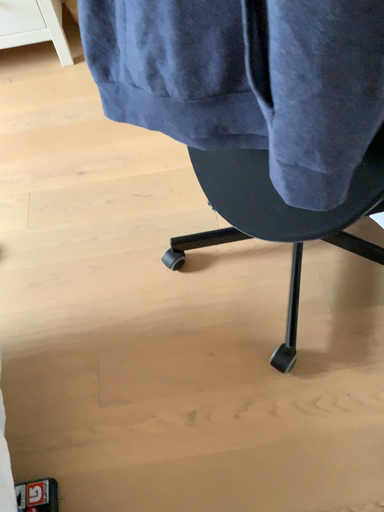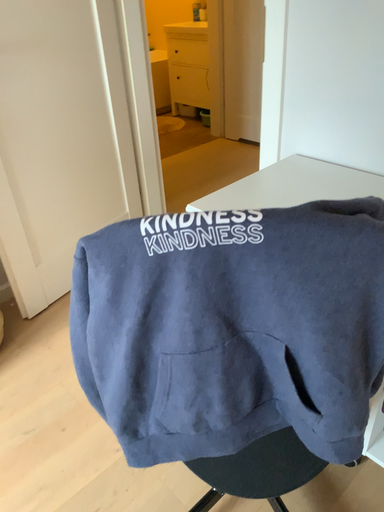
Question: How did the camera likely rotate when shooting the video?

Choices:
 (A) rotated right
 (B) rotated left

Answer: (A)